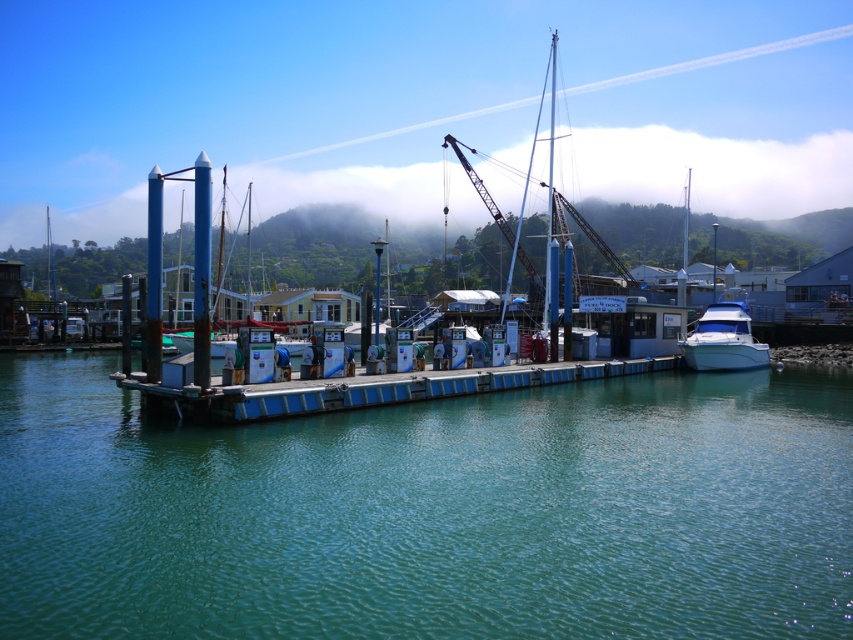
From the picture: You are standing at the edge of the marina and want to walk towards the point labeled point (282, 572). Will you pass by point (117, 214) before reaching your destination?

Yes, because point (282, 572) is in front of point (117, 214), so you will pass point (117, 214) on your way there.

You are standing at the edge of the marina and want to reach the blue painted wood dock at center. According to the coordinates provided, in which direction should you walk from your current position to reach it?

The blue painted wood dock at center is located at coordinates point (367,390). Since you are at the edge of the marina, you should walk towards the center of the image to reach it.

Looking at this image, you are a drone operator trying to capture the marina scene. Your drone has a limited flight altitude of 10 meters. Considering the height difference between the teal glossy water at center and the foggy misty hillside at upper center, will your drone be able to fly over both objects without exceeding its altitude limit?

The teal glossy water at center has a lesser height compared to the foggy misty hillside at upper center. Since the drone can only fly up to 10 meters, it depends on the actual heights of both objects. If the hillside exceeds 10 meters, the drone cannot fly over it, but it can still fly over the water if it is below 10 meters. However, without specific measurements, we cannot confirm if both are within the limit.